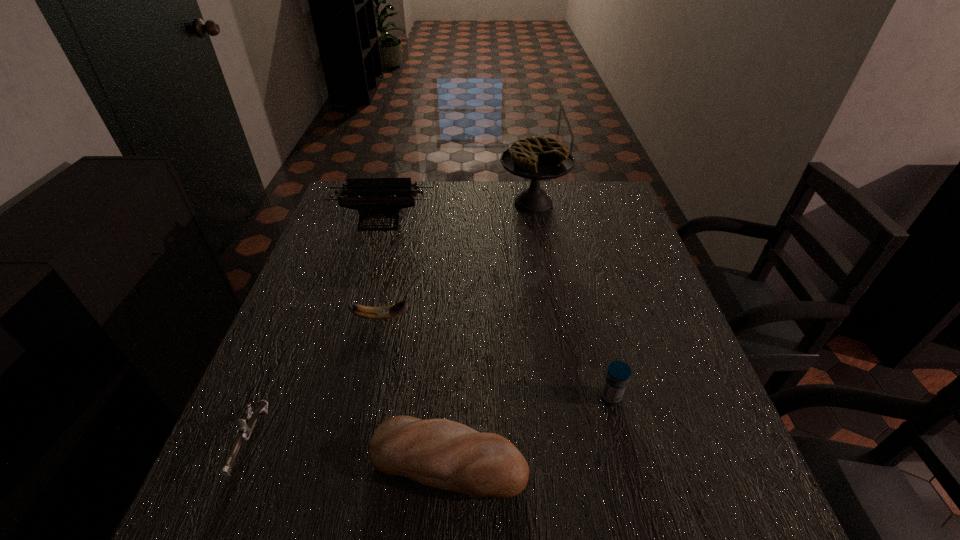
The width and height of the screenshot is (960, 540). I want to click on the tallest object, so click(x=537, y=158).

This screenshot has width=960, height=540. What are the coordinates of `typewriter` in the screenshot? It's located at (374, 198).

You are a GUI agent. You are given a task and a screenshot of the screen. Output one action in this format:
    pyautogui.click(x=<x>, y=<y>)
    Task: Click on the medicine
    Image resolution: width=960 pixels, height=540 pixels.
    Given the screenshot: What is the action you would take?
    pyautogui.click(x=618, y=373)

You are a GUI agent. You are given a task and a screenshot of the screen. Output one action in this format:
    pyautogui.click(x=<x>, y=<y>)
    Task: Click on the third farthest object
    This screenshot has width=960, height=540.
    Given the screenshot: What is the action you would take?
    pyautogui.click(x=385, y=312)

The width and height of the screenshot is (960, 540). I want to click on bread, so click(440, 453).

I want to click on gun, so click(x=245, y=426).

In order to click on free space located on the cut side of the tallest object in this screenshot , I will do `click(539, 233)`.

The height and width of the screenshot is (540, 960). In order to click on free space located 0.170m on the typing side of the typewriter in this screenshot , I will do `click(367, 272)`.

Where is `free region located on the left of the medicine`? The image size is (960, 540). free region located on the left of the medicine is located at coordinates (439, 397).

Locate an element on the screen. free spot located on the peel of the banana is located at coordinates (570, 318).